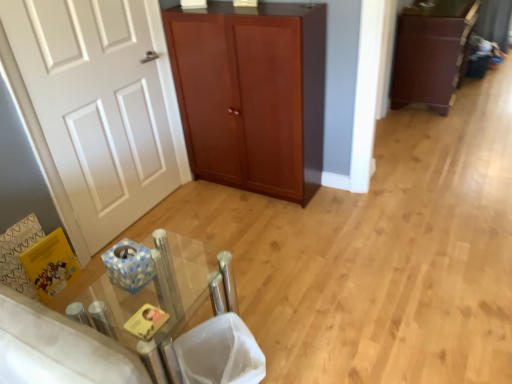
At what (x,y) coordinates should I click in order to perform the action: click on free point in front of white matte door at left. Please return your answer as a coordinate pair (x, y). Looking at the image, I should click on (132, 236).